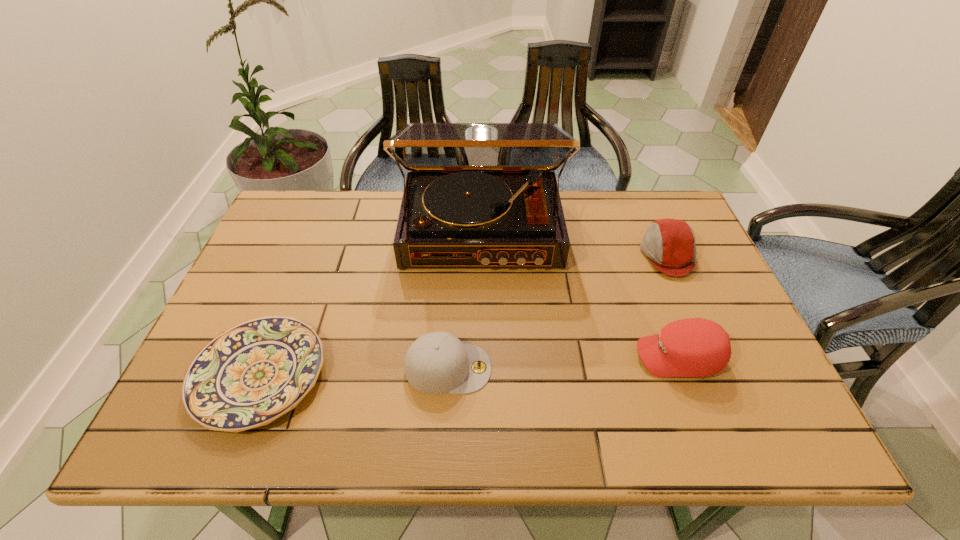
Image resolution: width=960 pixels, height=540 pixels. I want to click on vacant space at the far left corner of the desktop, so click(313, 227).

Identify the location of vacant space that is in between the record player and the farthest cap. (574, 242).

The image size is (960, 540). I want to click on empty location between the farthest cap and the record player, so click(574, 242).

Where is `free spot between the farthest cap and the leftmost object`? Image resolution: width=960 pixels, height=540 pixels. free spot between the farthest cap and the leftmost object is located at coordinates (464, 315).

Locate an element on the screen. This screenshot has height=540, width=960. object that can be found as the closest to the farthest cap is located at coordinates (694, 347).

This screenshot has width=960, height=540. In order to click on object that is the closest to the farthest cap in this screenshot , I will do 694,347.

Identify which cap is located as the third nearest to the shortest object. Please provide its 2D coordinates. Your answer should be formatted as a tuple, i.e. [(x, y)], where the tuple contains the x and y coordinates of a point satisfying the conditions above.

[(669, 244)]

Select which cap appears as the second closest to the tallest object. Please provide its 2D coordinates. Your answer should be formatted as a tuple, i.e. [(x, y)], where the tuple contains the x and y coordinates of a point satisfying the conditions above.

[(436, 363)]

I want to click on free region that satisfies the following two spatial constraints: 1. on the front-facing side of the record player; 2. on the front-facing side of the leftmost cap, so click(x=482, y=368).

You are a GUI agent. You are given a task and a screenshot of the screen. Output one action in this format:
    pyautogui.click(x=<x>, y=<y>)
    Task: Click on the vacant space that satisfies the following two spatial constraints: 1. on the front-facing side of the record player; 2. on the front-facing side of the leftmost cap
    
    Given the screenshot: What is the action you would take?
    pyautogui.click(x=482, y=368)